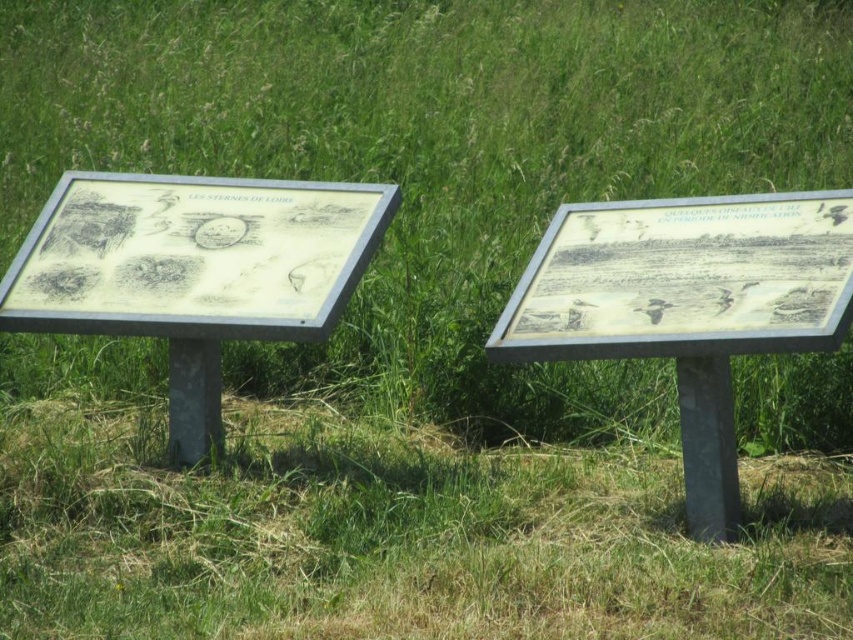
You are standing in front of two signs in a grassy area. The matte paper sign at left and the matte silver sign at right. Which one is higher up?

The matte paper sign at left is located above the matte silver sign at right, so it is higher up.

In the scene shown: Based on the scene description, where is the matte paper sign at left located in terms of coordinates?

The matte paper sign at left is located at coordinates point (193,257).